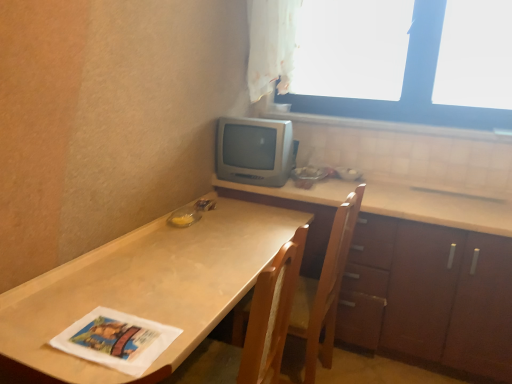
The height and width of the screenshot is (384, 512). In order to click on free space above white tile at upper right (from a real-world perspective) in this screenshot , I will do `click(371, 119)`.